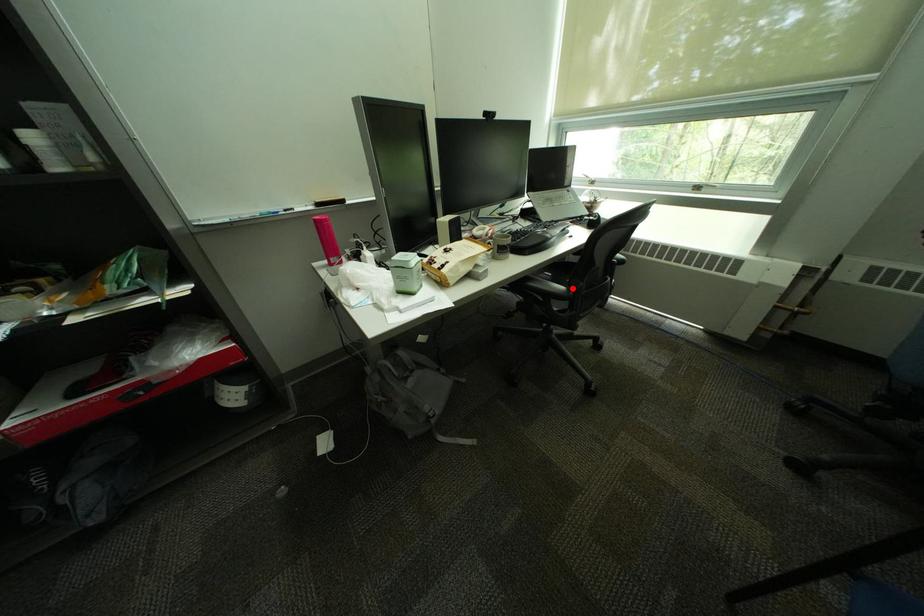
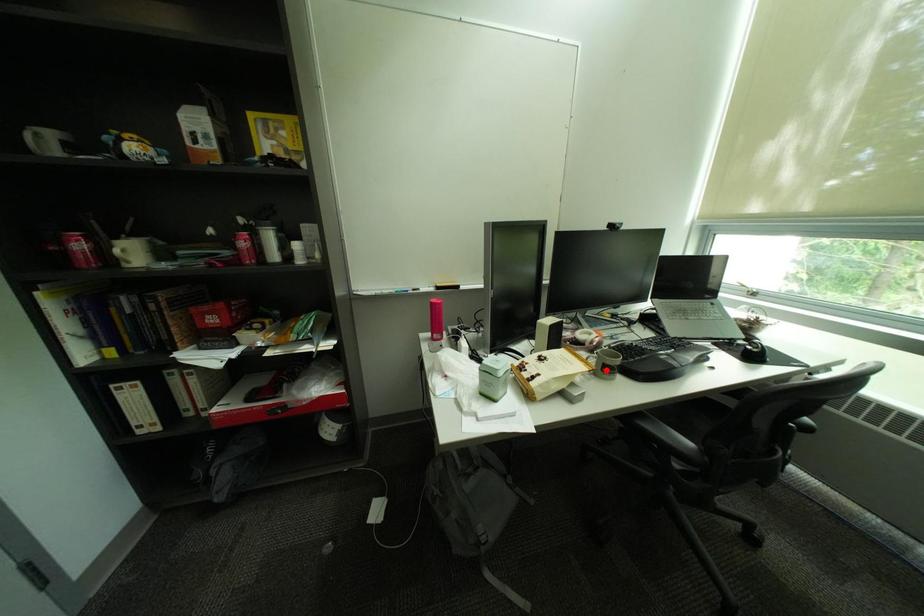
I am providing you with two images of the same scene from different viewpoints. A red point is marked on the first image and another point is marked on the second image. Is the red point in image1 aligned with the point shown in image2?

No